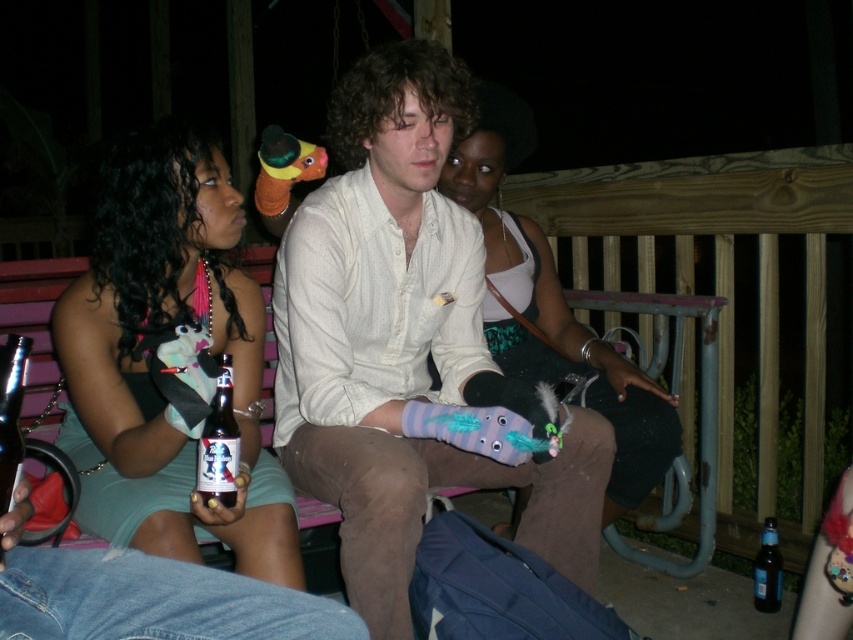
You are a photographer trying to capture a closeup of the matte black dress at center and the matte purple plush toy at center. Since you want to focus on both objects equally, which one should you adjust the camera focus for first, considering their sizes?

The matte black dress at center is wider than the matte purple plush toy at center. To focus on both equally, adjust the camera focus starting with the larger object, the matte black dress at center, then ensure the smaller matte purple plush toy at center is also in focus.

You are at a party and want to place both the matte purple plush toy at center and the dark blue glass bottle at lower right on a small table that can only hold one item. Which item should you choose to place on the table first to ensure it fits?

The matte purple plush toy at center has a larger width than the dark blue glass bottle at lower right. Since the table can only hold one item, you should choose the smaller item, the dark blue glass bottle at lower right, to place on the table first to ensure it fits.